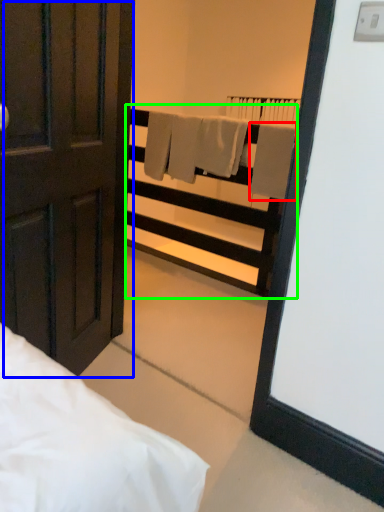
Question: Estimate the real-world distances between objects in this image. Which object is farther from bath towel (highlighted by a red box), door (highlighted by a blue box) or balustrade (highlighted by a green box)?

Choices:
 (A) door
 (B) balustrade

Answer: (A)